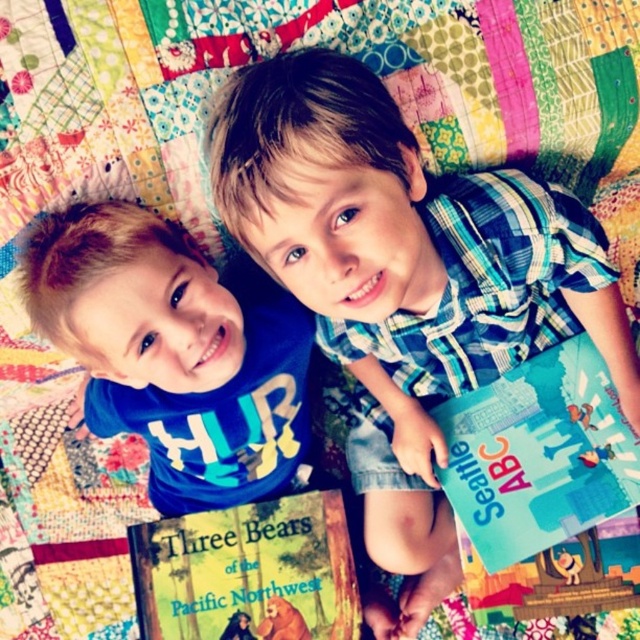
You are a librarian organizing books on a shelf. You have a teal glossy book at right and a hardcover book at center. Which book should you place to the left of the other?

The teal glossy book at right should be placed to the right of the hardcover book at center, so the hardcover book at center should be placed to the left of the teal glossy book at right.

You are a photographer standing at the camera position. You want to place a teal glossy book at right so that it is exactly 0.3 units to the left of point (538,454). What are the coordinates of the new position?

The new coordinates would be calculated by subtracting 0.3 from the x value of the original point. The original point is at (538,454). Subtracting 0.3 from the x coordinate gives 0.711 minus 0.3 equals 0.411. The y coordinate remains unchanged at 0.842. Therefore, the new position for the teal glossy book at right would be 0.411, 0.842.